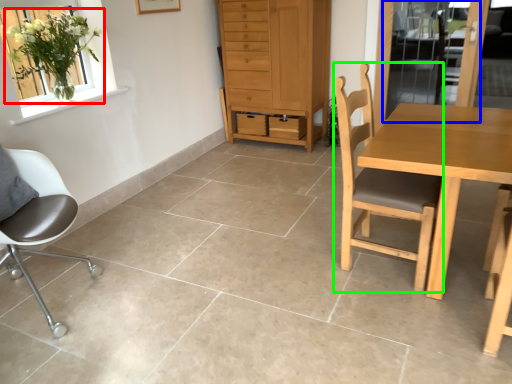
Question: Which object is positioned closest to houseplant (highlighted by a red box)? Select from screen door (highlighted by a blue box) and chair (highlighted by a green box).

Choices:
 (A) screen door
 (B) chair

Answer: (B)